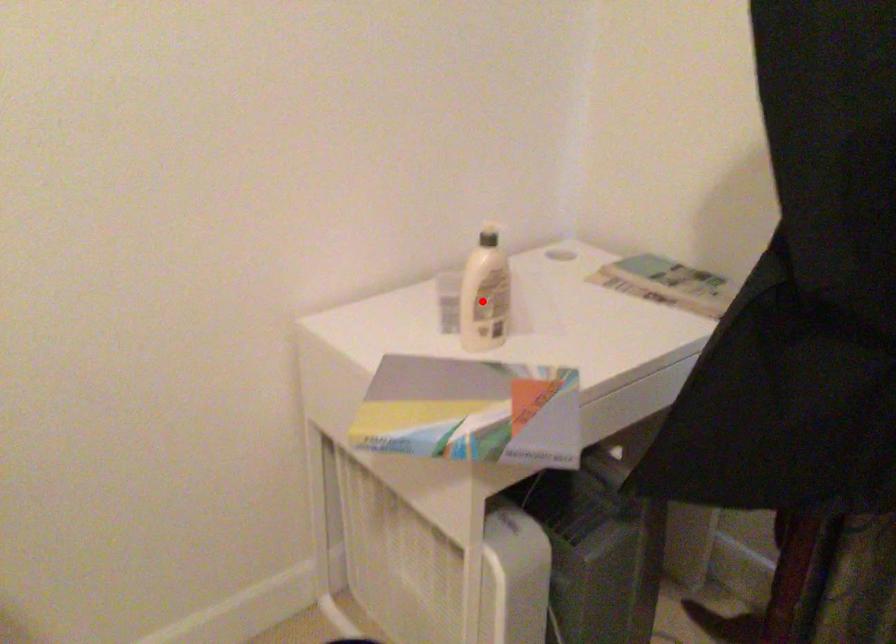
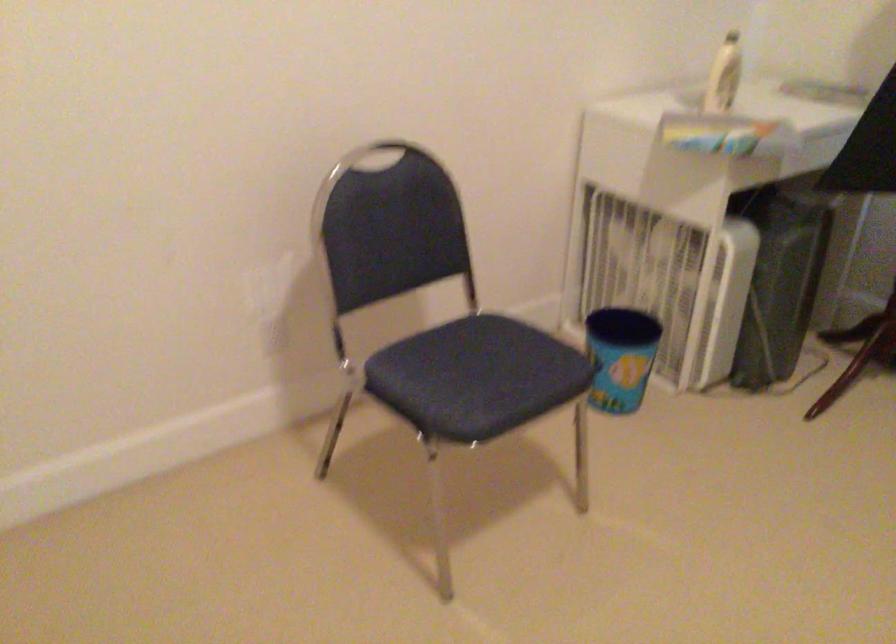
Find the pixel in the second image that matches the highlighted location in the first image.

(724, 76)